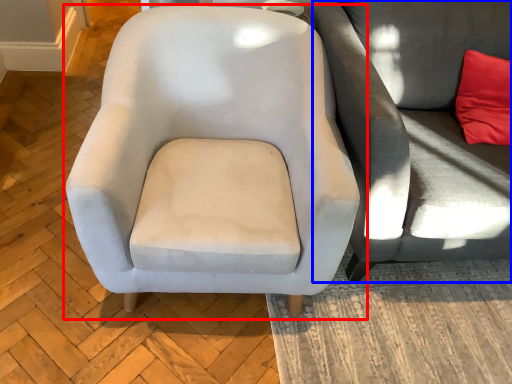
Question: Which point is further to the camera, chair (highlighted by a red box) or studio couch (highlighted by a blue box)?

Choices:
 (A) chair
 (B) studio couch

Answer: (B)